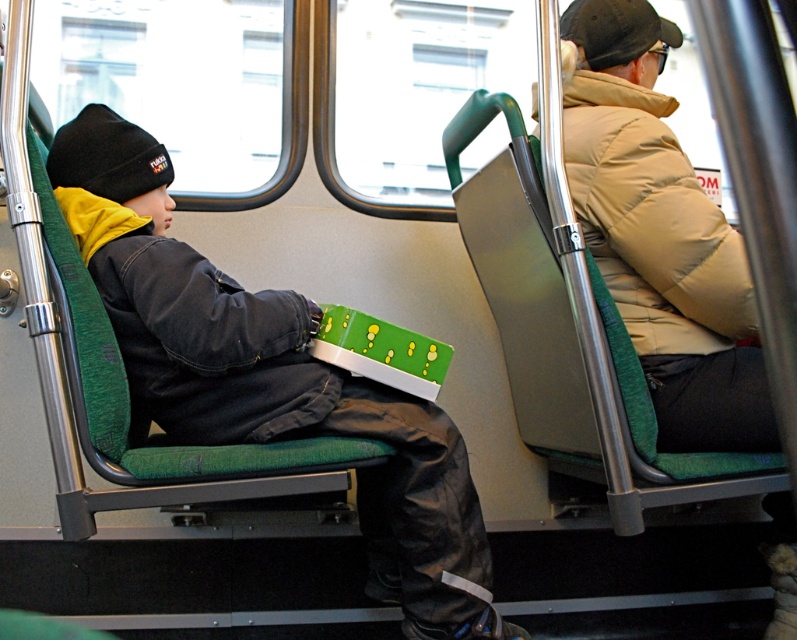
Looking at this image, does matte black beanie at left appear on the left side of black fleece beanie at left?

No, matte black beanie at left is not to the left of black fleece beanie at left.

From the picture: Is matte black beanie at left below black fleece beanie at left?

Yes.

Does point (132, 298) lie in front of point (89, 108)?

Yes, it is.

The width and height of the screenshot is (797, 640). I want to click on matte black beanie at left, so click(x=269, y=378).

Based on the photo, can you confirm if black fleece beanie at left is positioned to the right of black knit cap at upper right?

In fact, black fleece beanie at left is to the left of black knit cap at upper right.

Who is higher up, black fleece beanie at left or black knit cap at upper right?

black knit cap at upper right

Does point (93, 180) come in front of point (595, 28)?

Yes.

The width and height of the screenshot is (797, 640). In order to click on black fleece beanie at left in this screenshot , I will do `click(108, 156)`.

Is beige puffy jacket at upper right closer to camera compared to black fleece beanie at left?

Yes, beige puffy jacket at upper right is in front of black fleece beanie at left.

Does beige puffy jacket at upper right appear on the left side of black fleece beanie at left?

Incorrect, beige puffy jacket at upper right is not on the left side of black fleece beanie at left.

Find the location of a particular element. beige puffy jacket at upper right is located at coordinates (652, 221).